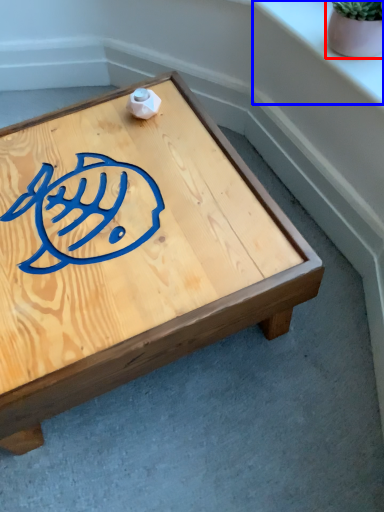
Question: Which of the following is the farthest to the observer, flowerpot (highlighted by a red box) or window sill (highlighted by a blue box)?

Choices:
 (A) flowerpot
 (B) window sill

Answer: (B)